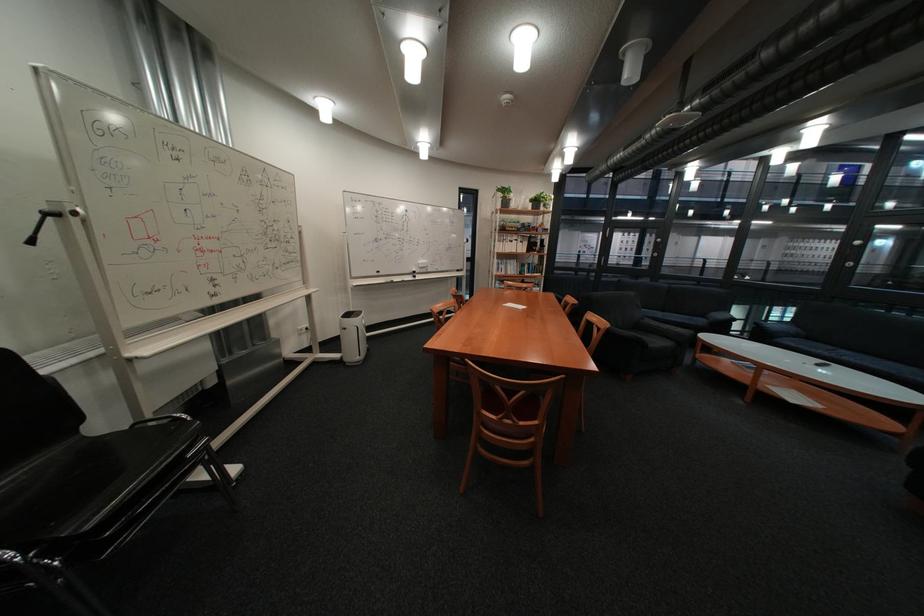
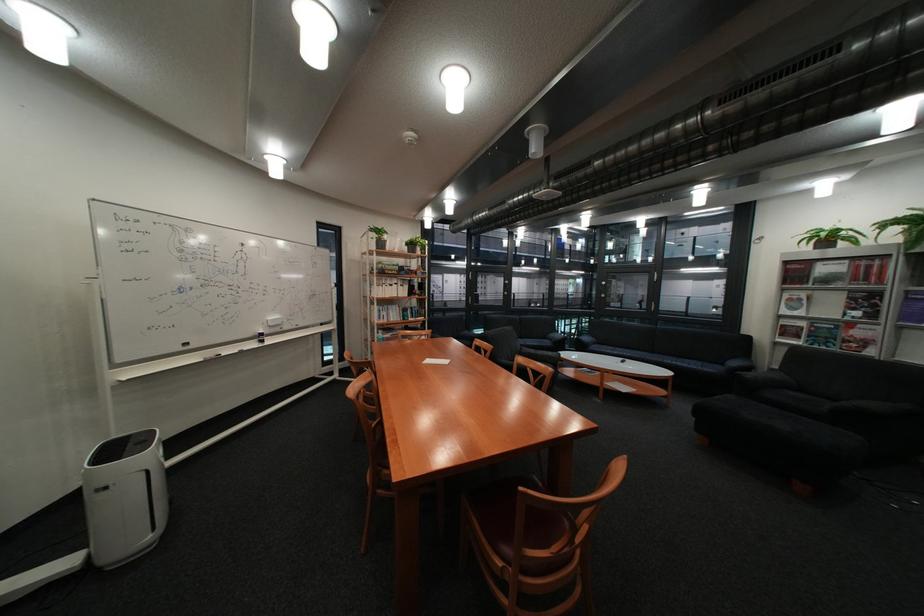
In the second image, find the point that corresponds to [546,201] in the first image.

(421, 245)